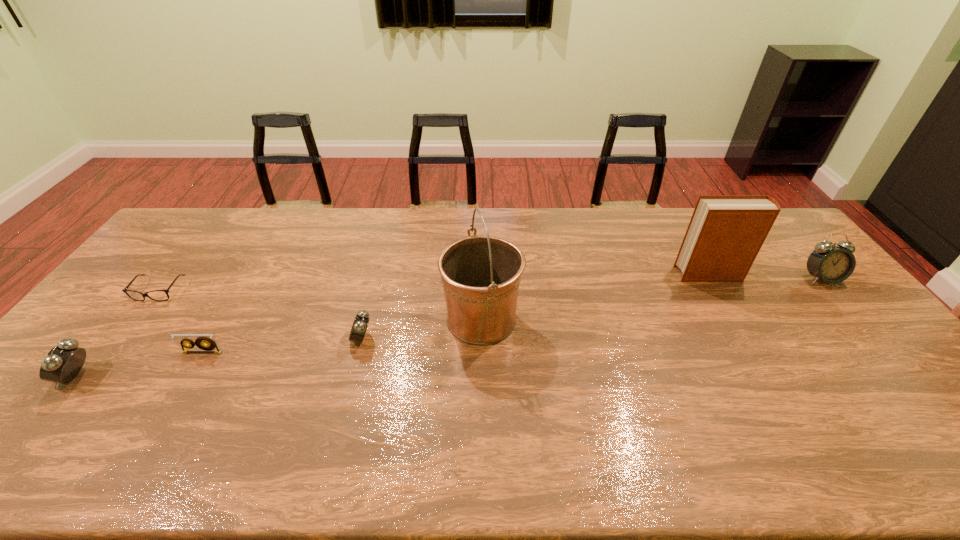
Please determine a free point for an extra alarm_clock to ensure balance. Please provide its 2D coordinates. Your answer should be formatted as a tuple, i.e. [(x, y)], where the tuple contains the x and y coordinates of a point satisfying the conditions above.

[(608, 307)]